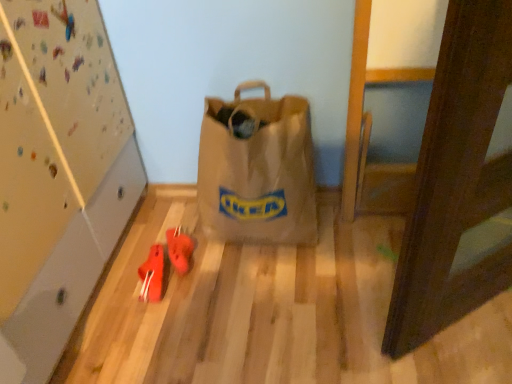
The image size is (512, 384). In order to click on free space to the right of brown paper bag at center in this screenshot , I will do `click(355, 240)`.